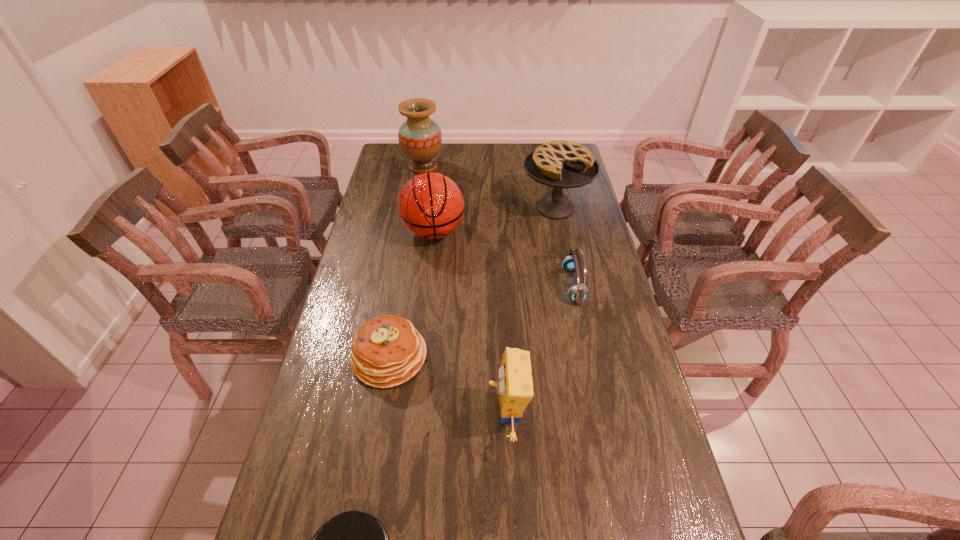
Locate an element on the screen. This screenshot has width=960, height=540. vase positioned at the left edge is located at coordinates (420, 138).

This screenshot has height=540, width=960. In order to click on basketball positioned at the left edge in this screenshot , I will do `click(430, 205)`.

Locate an element on the screen. Image resolution: width=960 pixels, height=540 pixels. pancake at the left edge is located at coordinates tap(387, 351).

Locate an element on the screen. Image resolution: width=960 pixels, height=540 pixels. pie that is at the right edge is located at coordinates (562, 164).

Find the location of a particular element. The width and height of the screenshot is (960, 540). headset present at the right edge is located at coordinates (574, 262).

Where is `object that is at the far left corner`? The width and height of the screenshot is (960, 540). object that is at the far left corner is located at coordinates (420, 138).

Image resolution: width=960 pixels, height=540 pixels. What are the coordinates of `free region at the left edge of the desktop` in the screenshot? It's located at (374, 315).

Find the location of a particular element. The image size is (960, 540). vacant region at the right edge of the desktop is located at coordinates (598, 353).

Identify the location of empty space that is in between the farthest object and the third shortest object. The width and height of the screenshot is (960, 540). (498, 226).

Locate an element on the screen. free spot between the sponge and the pie is located at coordinates (531, 311).